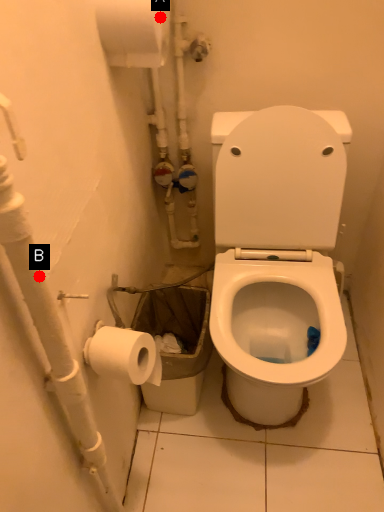
Question: Two points are circled on the image, labeled by A and B beside each circle. Among these points, which one is nearest to the camera?

Choices:
 (A) A is closer
 (B) B is closer

Answer: (B)